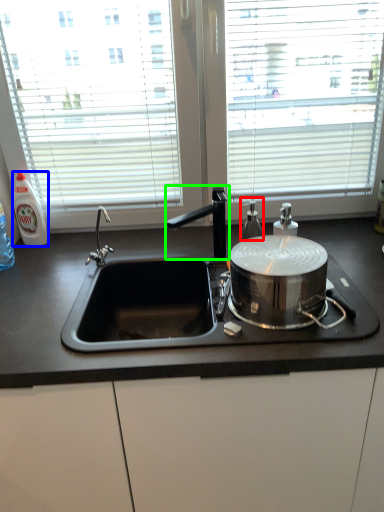
Question: Based on their relative distances, which object is farther from bottle (highlighted by a red box)? Choose from bottle (highlighted by a blue box) and tap (highlighted by a green box).

Choices:
 (A) bottle
 (B) tap

Answer: (A)